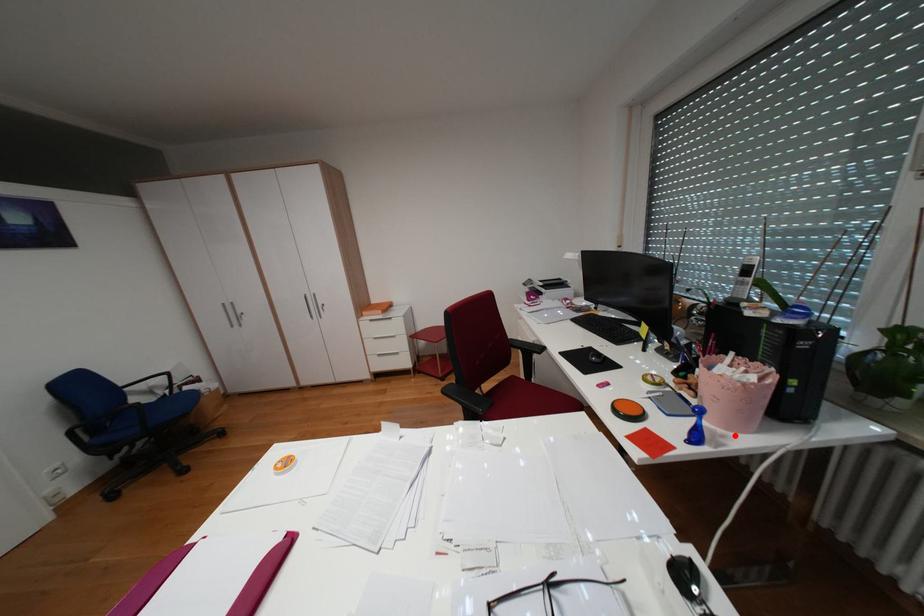
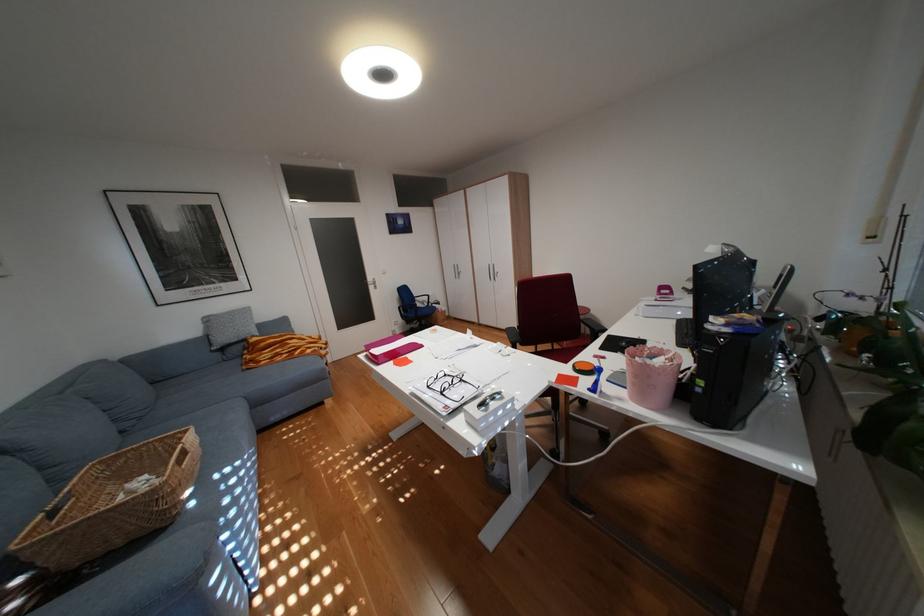
Locate, in the second image, the point that corresponds to the highlighted location in the first image.

(633, 399)